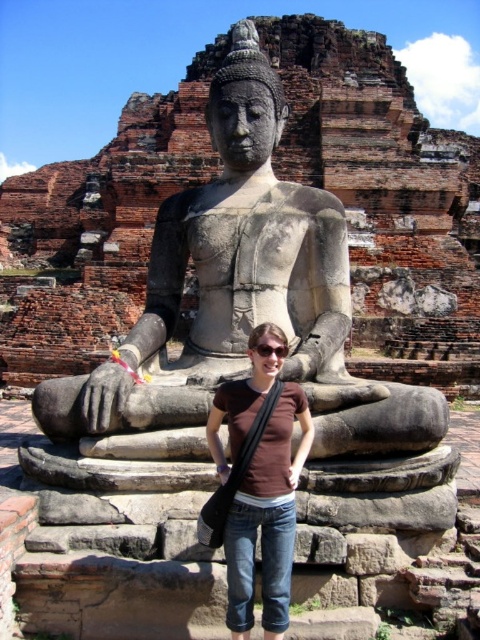
Question: Which object appears farthest from the camera in this image?

Choices:
 (A) gray stone statue at center
 (B) brown cotton shirt at center

Answer: (A)

Question: Can you confirm if gray stone statue at center is smaller than brown cotton shirt at center?

Choices:
 (A) no
 (B) yes

Answer: (A)

Question: Is gray stone statue at center above brown cotton shirt at center?

Choices:
 (A) yes
 (B) no

Answer: (A)

Question: Where is gray stone statue at center located in relation to brown cotton shirt at center in the image?

Choices:
 (A) below
 (B) above

Answer: (B)

Question: Which object is farther from the camera taking this photo?

Choices:
 (A) gray stone statue at center
 (B) brown cotton shirt at center

Answer: (A)